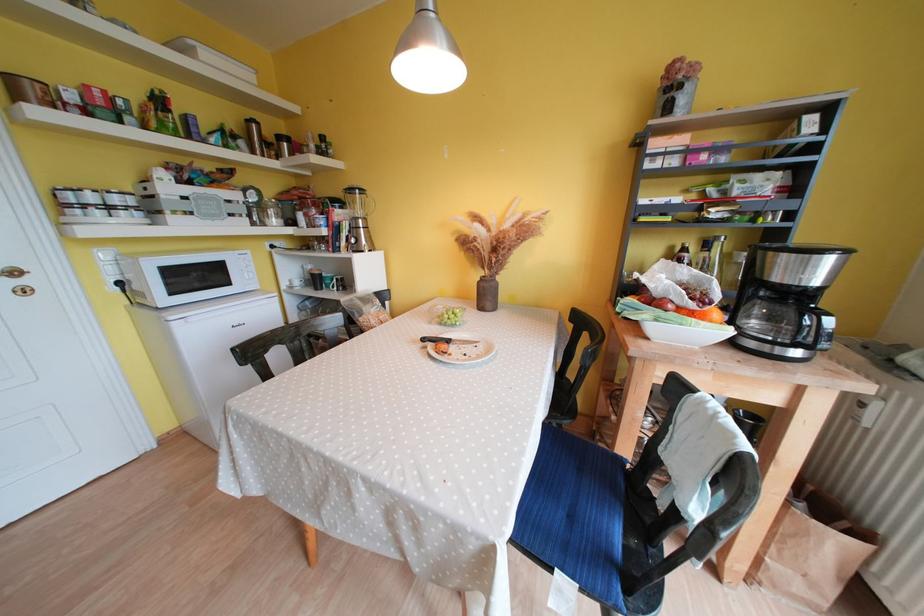
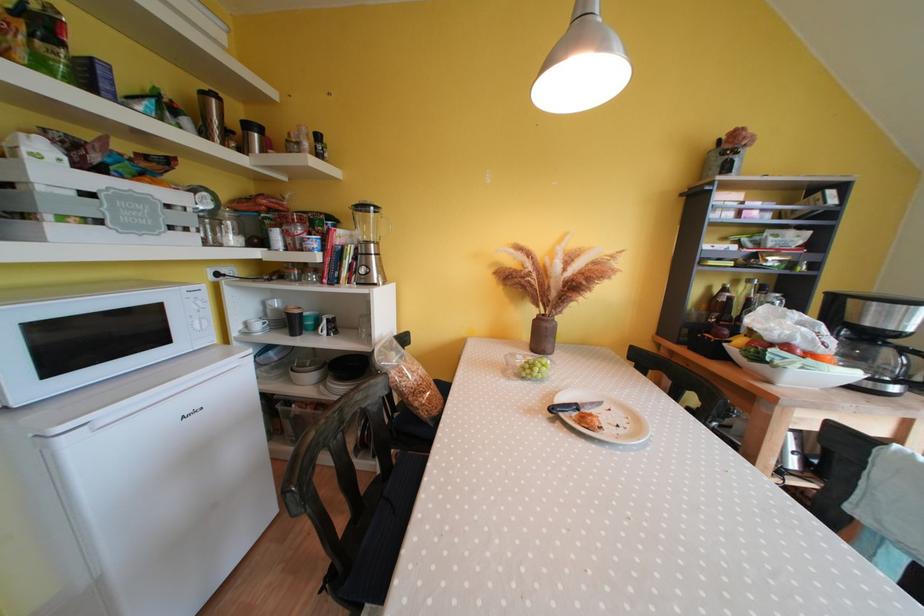
Where in the second image is the point corresponding to pixel 492 289 from the first image?

(554, 330)